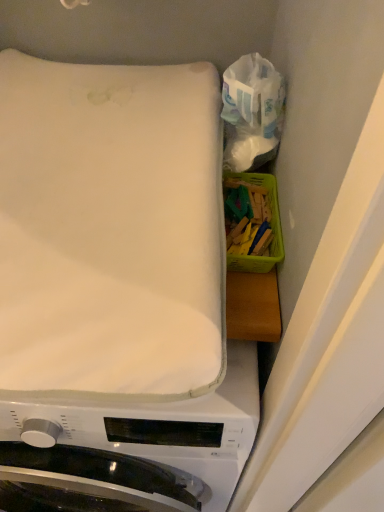
In order to face white soft mattress at upper left, should I rotate leftwards or rightwards?

Rotate your view left by about 16.402°.

In order to click on translucent plastic bag at upper right in this screenshot , I will do `click(252, 112)`.

Would you say white fabric at upper left is inside or outside white soft mattress at upper left?

white fabric at upper left is not enclosed by white soft mattress at upper left.

Consider the image. Considering the relative positions of white fabric at upper left and white soft mattress at upper left in the image provided, is white fabric at upper left in front of white soft mattress at upper left?

No, white fabric at upper left is behind white soft mattress at upper left.

Considering the points (26, 476) and (85, 178), which point is in front, point (26, 476) or point (85, 178)?

The point (26, 476) is closer to the camera.

Which of these two, translucent plastic bag at upper right or white fabric at upper left, is wider?

white fabric at upper left is wider.

Is translucent plastic bag at upper right shorter than white fabric at upper left?

Yes.

From the picture: Is white fabric at upper left surrounded by translucent plastic bag at upper right?

No.

Considering the positions of objects translucent plastic bag at upper right and white fabric at upper left in the image provided, who is more to the right, translucent plastic bag at upper right or white fabric at upper left?

Positioned to the right is translucent plastic bag at upper right.

From a real-world perspective, is translucent plastic bag at upper right physically located above or below white soft mattress at upper left?

In terms of real-world spatial position, translucent plastic bag at upper right is above white soft mattress at upper left.

Is translucent plastic bag at upper right far away from white soft mattress at upper left?

That's not correct — translucent plastic bag at upper right is a little close to white soft mattress at upper left.

Is translucent plastic bag at upper right wider or thinner than white soft mattress at upper left?

Considering their sizes, translucent plastic bag at upper right looks slimmer than white soft mattress at upper left.

Looking at this image, how different are the orientations of translucent plastic bag at upper right and white soft mattress at upper left in degrees?

The angle between the facing direction of translucent plastic bag at upper right and the facing direction of white soft mattress at upper left is 87.5 degrees.

In the scene shown: Is white soft mattress at upper left oriented towards white fabric at upper left?

No, white soft mattress at upper left is not facing towards white fabric at upper left.

Can you confirm if white soft mattress at upper left is positioned to the left of white fabric at upper left?

Incorrect, white soft mattress at upper left is not on the left side of white fabric at upper left.

How far apart are white soft mattress at upper left and white fabric at upper left?

A distance of 11.20 inches exists between white soft mattress at upper left and white fabric at upper left.

The image size is (384, 512). I want to click on washing machine that appears below the white soft mattress at upper left (from a real-world perspective), so click(x=136, y=446).

From a real-world perspective, between white fabric at upper left and translucent plastic bag at upper right, who is vertically lower?

white fabric at upper left, from a real-world perspective.

Which is in front, point (194, 463) or point (231, 152)?

Point (194, 463)

Could you tell me if white fabric at upper left is turned towards translucent plastic bag at upper right?

No, white fabric at upper left is not aimed at translucent plastic bag at upper right.

Is white soft mattress at upper left positioned before translucent plastic bag at upper right?

That is True.

In order to click on tissue located on the right of white soft mattress at upper left in this screenshot , I will do `click(252, 112)`.

Does point (127, 186) lie in front of point (282, 83)?

No, it is behind (282, 83).

From the image's perspective, is white soft mattress at upper left beneath translucent plastic bag at upper right?

Yes.

Find the location of `mattress to the right of white fabric at upper left`. mattress to the right of white fabric at upper left is located at coordinates (110, 229).

Image resolution: width=384 pixels, height=512 pixels. Identify the location of washing machine below the translucent plastic bag at upper right (from a real-world perspective). (136, 446).

From the image, which object appears to be farther from white soft mattress at upper left, white fabric at upper left or translucent plastic bag at upper right?

Based on the image, white fabric at upper left appears to be further to white soft mattress at upper left.

Based on their spatial positions, is translucent plastic bag at upper right or white soft mattress at upper left closer to white fabric at upper left?

Based on the image, white soft mattress at upper left appears to be nearer to white fabric at upper left.

Estimate the real-world distances between objects in this image. Which object is closer to translucent plastic bag at upper right, white fabric at upper left or white soft mattress at upper left?

Among the two, white soft mattress at upper left is located nearer to translucent plastic bag at upper right.

Based on their spatial positions, is translucent plastic bag at upper right or white fabric at upper left further from white soft mattress at upper left?

Based on the image, white fabric at upper left appears to be further to white soft mattress at upper left.

Considering their positions, is white soft mattress at upper left positioned closer to white fabric at upper left than translucent plastic bag at upper right?

white soft mattress at upper left is positioned closer to the anchor white fabric at upper left.

Considering their positions, is white soft mattress at upper left positioned further to translucent plastic bag at upper right than white fabric at upper left?

white fabric at upper left.

Find the location of a particular element. This screenshot has height=512, width=384. mattress between translucent plastic bag at upper right and white fabric at upper left vertically is located at coordinates (110, 229).